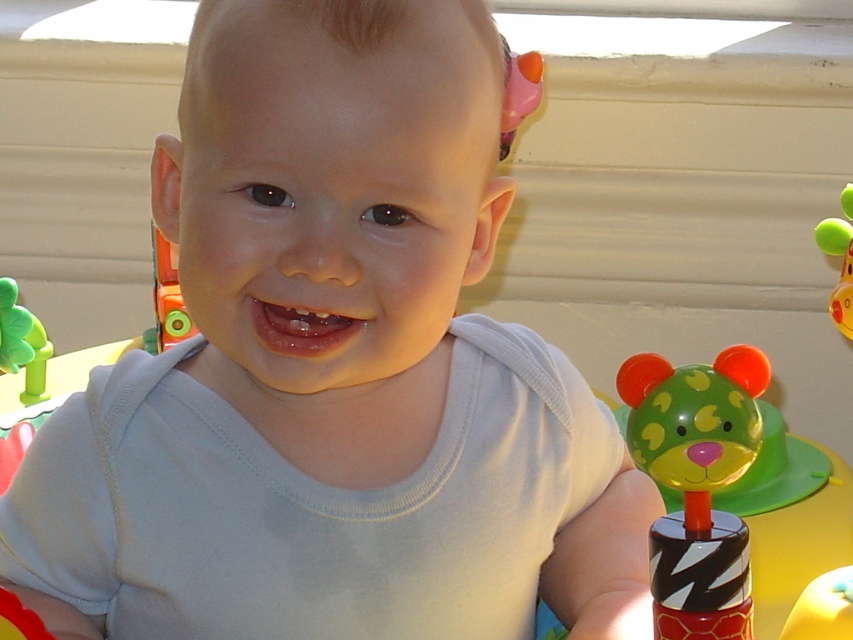
Is green rubber toy at left to the right of green rubber duck at right from the viewer's perspective?

No, green rubber toy at left is not to the right of green rubber duck at right.

Which is more to the right, green rubber toy at left or green rubber duck at right?

green rubber duck at right

I want to click on green rubber toy at left, so click(22, 342).

Identify the location of green rubber toy at left. (22, 342).

Between green matte bear at right and green rubber duck at right, which one is positioned higher?

green rubber duck at right is above.

Does green matte bear at right lie behind green rubber duck at right?

Yes, green matte bear at right is further from the viewer.

Who is more distant from viewer, (712, 490) or (840, 308)?

The point (712, 490) is behind.

The width and height of the screenshot is (853, 640). What are the coordinates of `green matte bear at right` in the screenshot? It's located at (x=730, y=490).

Does green matte bear at right have a lesser width compared to green rubber toy at left?

No.

Is point (746, 506) behind point (4, 356)?

Yes, point (746, 506) is behind point (4, 356).

Does point (828, 518) lie in front of point (7, 358)?

No, it is not.

Image resolution: width=853 pixels, height=640 pixels. I want to click on green matte bear at right, so click(730, 490).